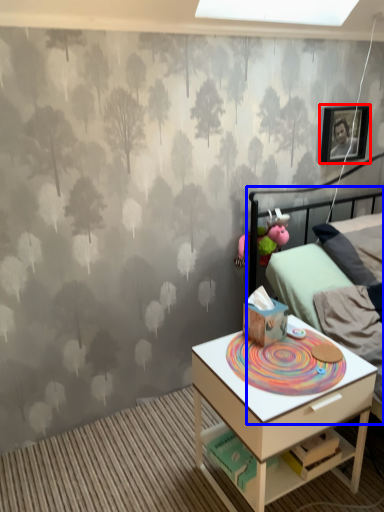
Question: Among these objects, which one is nearest to the camera, picture frame (highlighted by a red box) or bed (highlighted by a blue box)?

Choices:
 (A) picture frame
 (B) bed

Answer: (B)